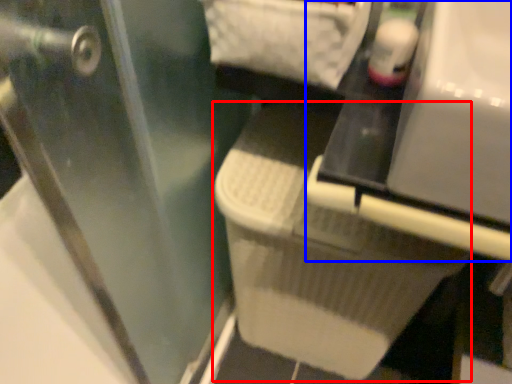
Question: Which object appears farthest to the camera in this image, laundry basket (highlighted by a red box) or vanity (highlighted by a blue box)?

Choices:
 (A) laundry basket
 (B) vanity

Answer: (A)